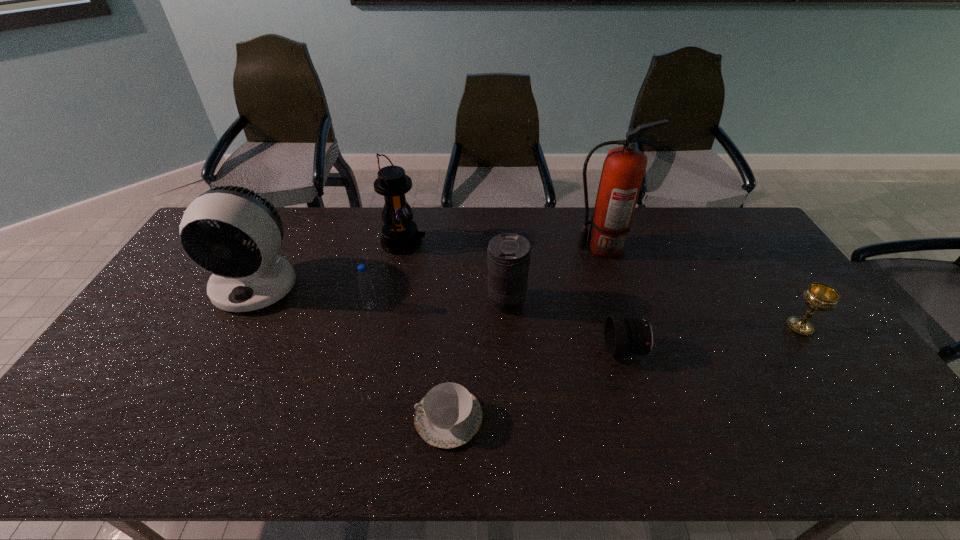
The image size is (960, 540). Identify the location of empty space between the second shortest object and the fan. pos(441,318).

Locate an element on the screen. This screenshot has width=960, height=540. vacant region between the rightmost object and the left telephoto lens is located at coordinates (653, 315).

Locate an element on the screen. The height and width of the screenshot is (540, 960). vacant area that lies between the taller telephoto lens and the rightmost object is located at coordinates (653, 315).

The image size is (960, 540). In order to click on free area in between the water bottle and the lantern in this screenshot , I will do `click(387, 274)`.

This screenshot has width=960, height=540. I want to click on free space between the shorter telephoto lens and the water bottle, so click(498, 328).

Find the location of a particular element. The image size is (960, 540). empty space that is in between the chalice and the lantern is located at coordinates (601, 285).

The image size is (960, 540). What are the coordinates of `object that is the closest to the water bottle` in the screenshot? It's located at (400, 235).

Select which object is the closest to the fan. Please provide its 2D coordinates. Your answer should be formatted as a tuple, i.e. [(x, y)], where the tuple contains the x and y coordinates of a point satisfying the conditions above.

[(364, 279)]

Find the location of `free space in the image that satisfies the following two spatial constraints: 1. on the grille of the water bottle; 2. on the right side of the leftmost object`. free space in the image that satisfies the following two spatial constraints: 1. on the grille of the water bottle; 2. on the right side of the leftmost object is located at coordinates (246, 306).

At what (x,y) coordinates should I click in order to perform the action: click on free space that satisfies the following two spatial constraints: 1. on the grille of the fan; 2. on the right side of the chalice. Please return your answer as a coordinate pair (x, y). The image size is (960, 540). Looking at the image, I should click on (234, 327).